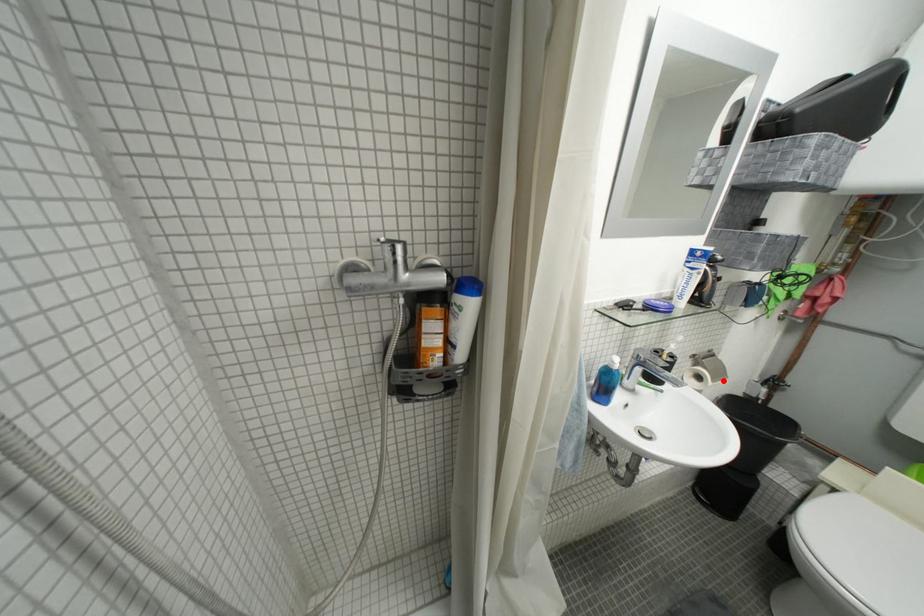
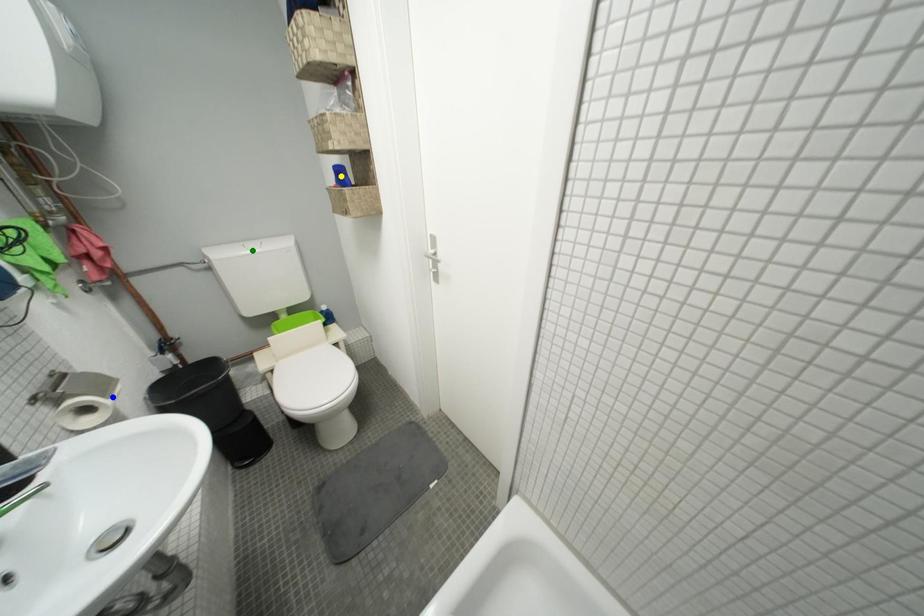
Question: I am providing you with two images of the same scene from different viewpoints. A red point is marked on the first image. You are given multiple points on the second image. In image 2, which mark is for the same physical point as the one in image 1?

Choices:
 (A) blue point
 (B) green point
 (C) yellow point

Answer: (A)